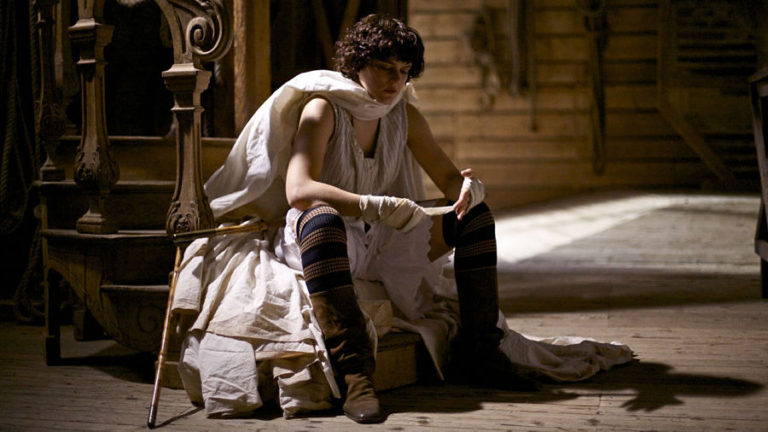
This screenshot has width=768, height=432. In order to click on stair steps in this screenshot , I will do `click(138, 290)`, `click(137, 232)`, `click(136, 188)`, `click(394, 356)`.